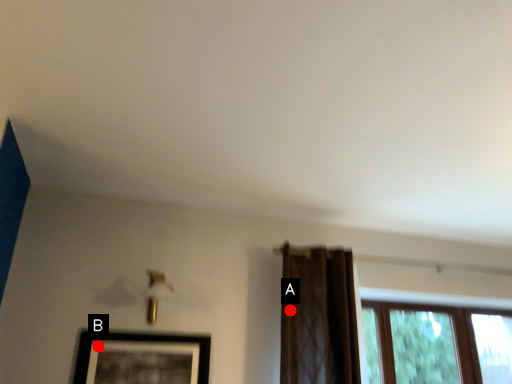
Question: Two points are circled on the image, labeled by A and B beside each circle. Which point is closer to the camera?

Choices:
 (A) A is closer
 (B) B is closer

Answer: (B)